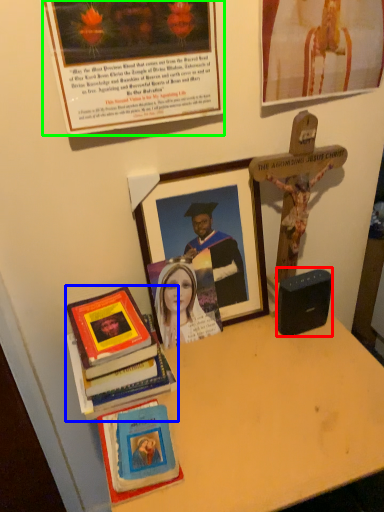
Question: Based on their relative distances, which object is nearer to speaker (highlighted by a red box)? Choose from book (highlighted by a blue box) and picture frame (highlighted by a green box).

Choices:
 (A) book
 (B) picture frame

Answer: (A)